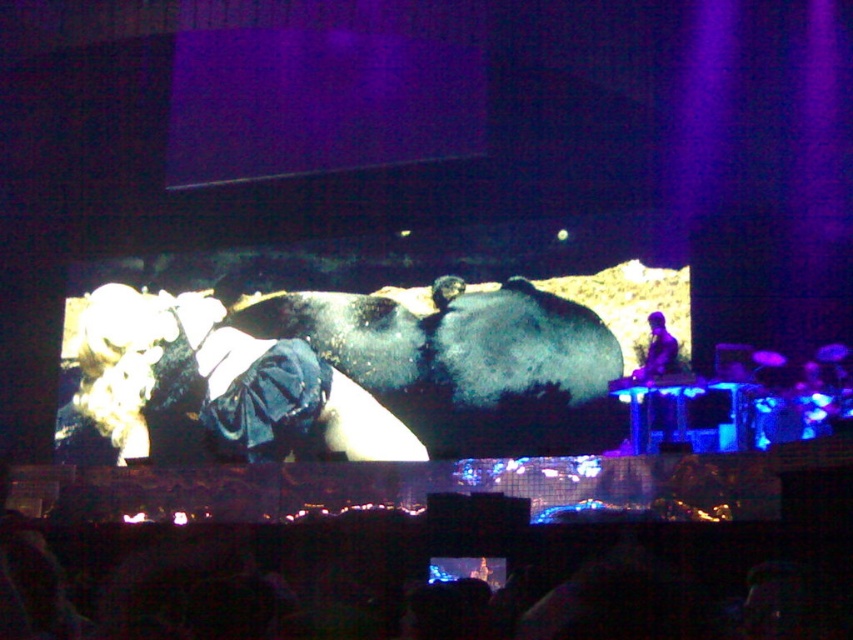
Describe the element at coordinates (225, 376) in the screenshot. The width and height of the screenshot is (853, 640). I see `shiny blue jacket at center` at that location.

Image resolution: width=853 pixels, height=640 pixels. I want to click on shiny blue jacket at center, so click(x=225, y=376).

Image resolution: width=853 pixels, height=640 pixels. In order to click on shiny blue jacket at center in this screenshot , I will do pyautogui.click(x=225, y=376).